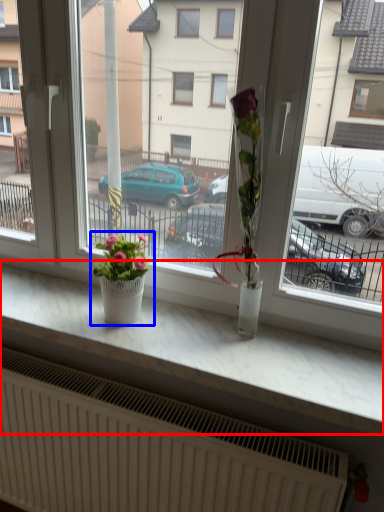
Question: Among these objects, which one is farthest to the camera, counter top (highlighted by a red box) or houseplant (highlighted by a blue box)?

Choices:
 (A) counter top
 (B) houseplant

Answer: (B)